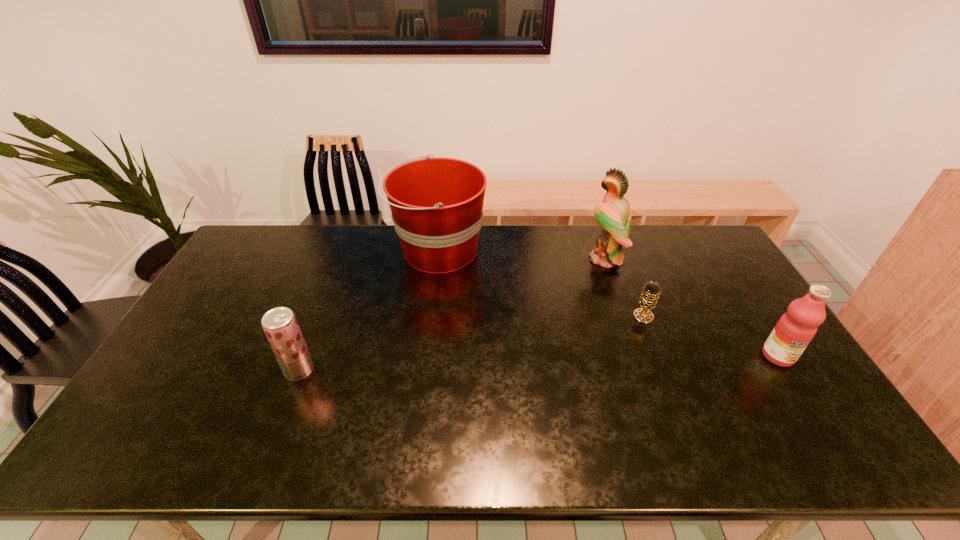
Find the location of `vacant space that is in between the left fruit juice and the fourth object from right to left`. vacant space that is in between the left fruit juice and the fourth object from right to left is located at coordinates (369, 310).

Locate an element on the screen. This screenshot has height=540, width=960. vacant region between the parrot and the bucket is located at coordinates (521, 255).

Where is `object that is the closest one to the second shortest object`? object that is the closest one to the second shortest object is located at coordinates (437, 203).

You are a GUI agent. You are given a task and a screenshot of the screen. Output one action in this format:
    pyautogui.click(x=<x>, y=<y>)
    Task: Click on the fourth closest object relative to the parrot
    This screenshot has width=960, height=540.
    Given the screenshot: What is the action you would take?
    pyautogui.click(x=280, y=325)

This screenshot has height=540, width=960. I want to click on free space that satisfies the following two spatial constraints: 1. on the front-facing side of the third farthest object; 2. on the right side of the parrot, so click(625, 316).

Identify the location of vacant space that satisfies the following two spatial constraints: 1. on the back side of the left fruit juice; 2. on the right side of the bucket. (344, 251).